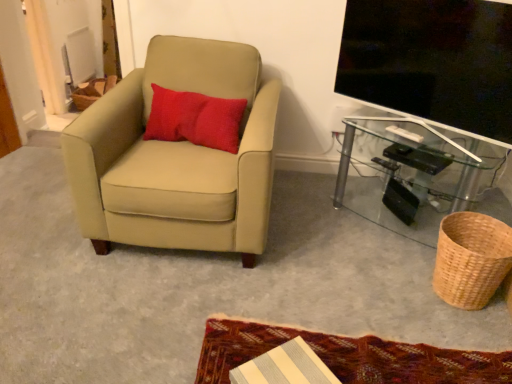
Question: Is point (358, 54) closer or farther from the camera than point (214, 357)?

Choices:
 (A) closer
 (B) farther

Answer: (B)

Question: Considering the relative positions of flat screen tv at upper right and textured woolen mat at lower center in the image provided, is flat screen tv at upper right to the left or to the right of textured woolen mat at lower center?

Choices:
 (A) right
 (B) left

Answer: (A)

Question: Considering the real-world distances, which object is closest to the red textured pillow at upper left?

Choices:
 (A) transparent glass table at lower right
 (B) suede beige armchair at left
 (C) textured woolen mat at lower center
 (D) flat screen tv at upper right
 (E) woven natural basket at lower right

Answer: (B)

Question: Estimate the real-world distances between objects in this image. Which object is closer to the transparent glass table at lower right?

Choices:
 (A) red textured pillow at upper left
 (B) textured woolen mat at lower center
 (C) suede beige armchair at left
 (D) flat screen tv at upper right
 (E) woven natural basket at lower right

Answer: (D)